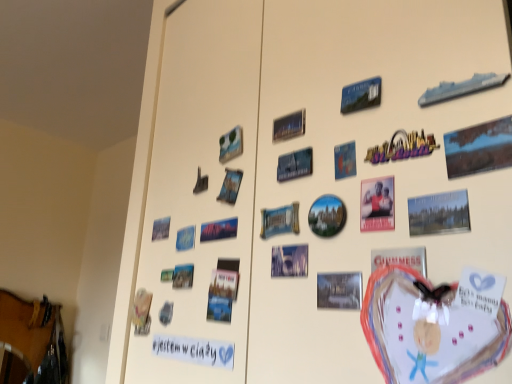
Question: Does metallic silver postcard at center right, the 3th postcard positioned from the right, turn towards white paper at lower left?

Choices:
 (A) yes
 (B) no

Answer: (B)

Question: Is metallic silver postcard at center right, the 3th postcard positioned from the right, touching white paper at lower left?

Choices:
 (A) yes
 (B) no

Answer: (B)

Question: Is metallic silver postcard at center right, the 3th postcard positioned from the right, further to camera compared to white paper at lower left?

Choices:
 (A) yes
 (B) no

Answer: (B)

Question: Would you say metallic silver postcard at center right, the 3th postcard positioned from the right, contains white paper at lower left?

Choices:
 (A) no
 (B) yes

Answer: (A)

Question: Does metallic silver postcard at center right, the 3th postcard positioned from the right, appear on the left side of white paper at lower left?

Choices:
 (A) yes
 (B) no

Answer: (B)

Question: Does metallic silver postcard at center right, the 3th postcard positioned from the right, have a smaller size compared to white paper at lower left?

Choices:
 (A) yes
 (B) no

Answer: (A)

Question: Is blue paper at upper left, positioned as the second postcard in left-to-right order, closer to camera compared to metallic silver postcard at center, the ninth postcard when ordered from right to left?

Choices:
 (A) yes
 (B) no

Answer: (B)

Question: From a real-world perspective, is blue paper at upper left, the twelfth postcard positioned from the right, physically below metallic silver postcard at center, arranged as the 5th postcard when viewed from the left?

Choices:
 (A) no
 (B) yes

Answer: (A)

Question: Can you confirm if blue paper at upper left, the twelfth postcard positioned from the right, is taller than metallic silver postcard at center, arranged as the 5th postcard when viewed from the left?

Choices:
 (A) no
 (B) yes

Answer: (B)

Question: Is blue paper at upper left, positioned as the second postcard in left-to-right order, thinner than metallic silver postcard at center, arranged as the 5th postcard when viewed from the left?

Choices:
 (A) no
 (B) yes

Answer: (A)

Question: From the image's perspective, does blue paper at upper left, positioned as the second postcard in left-to-right order, appear lower than metallic silver postcard at center, the ninth postcard when ordered from right to left?

Choices:
 (A) no
 (B) yes

Answer: (A)

Question: Is metallic silver postcard at center, the ninth postcard when ordered from right to left, completely or partially inside blue paper at upper left, positioned as the second postcard in left-to-right order?

Choices:
 (A) yes
 (B) no

Answer: (B)

Question: Would you say blue paper at upper left, the twelfth postcard positioned from the right, is part of blue glossy postcard at upper center, the eighth postcard in the left-to-right sequence,'s contents?

Choices:
 (A) yes
 (B) no

Answer: (B)